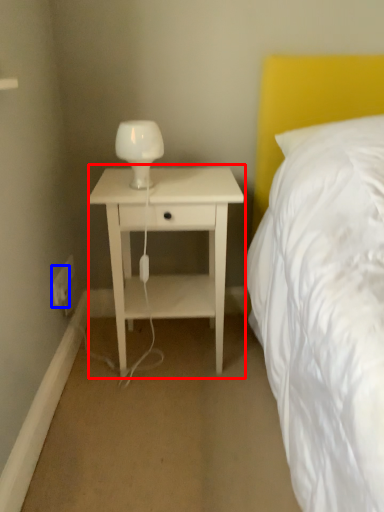
Question: Which object is closer to the camera taking this photo, nightstand (highlighted by a red box) or electric outlet (highlighted by a blue box)?

Choices:
 (A) nightstand
 (B) electric outlet

Answer: (A)